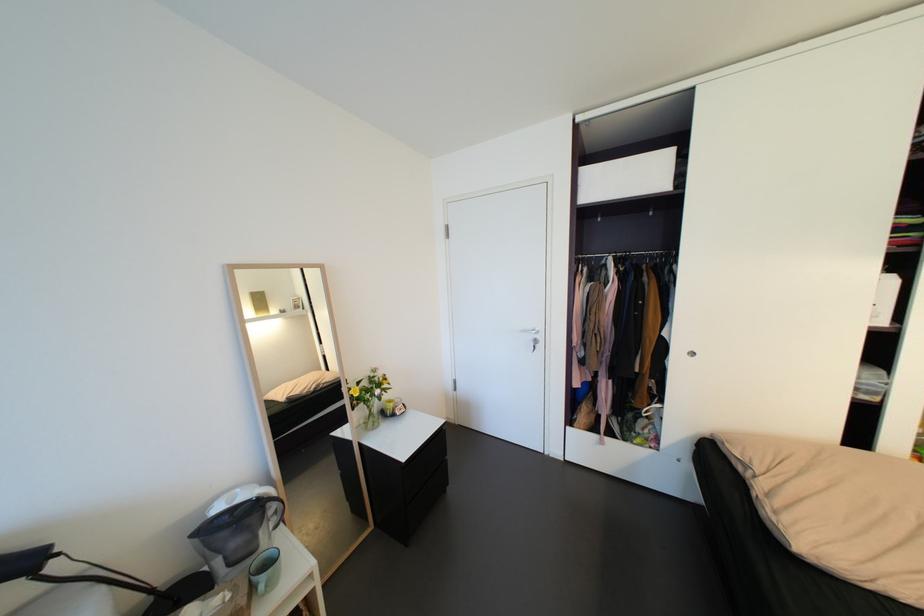
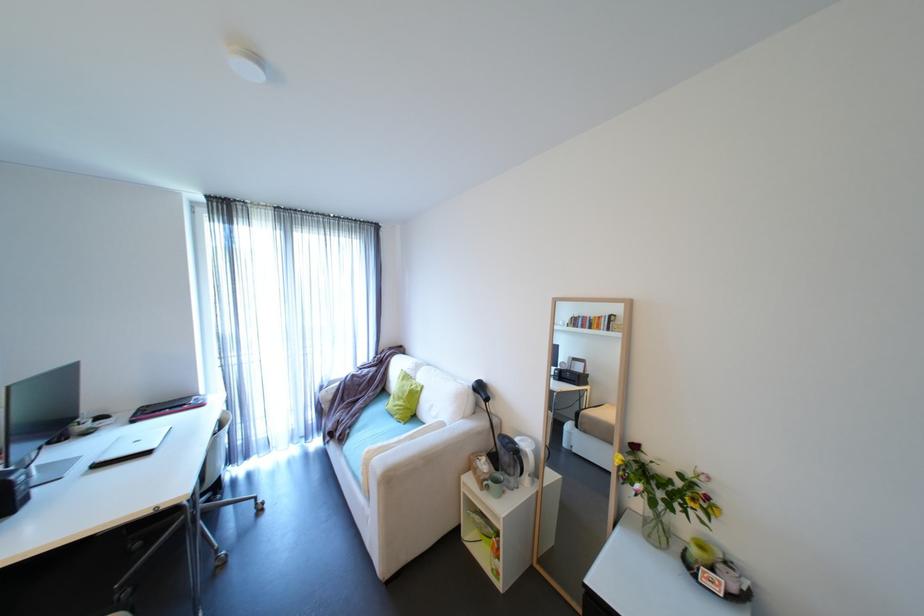
In the second image, find the point that corresponds to the point at 381,377 in the first image.

(703, 485)